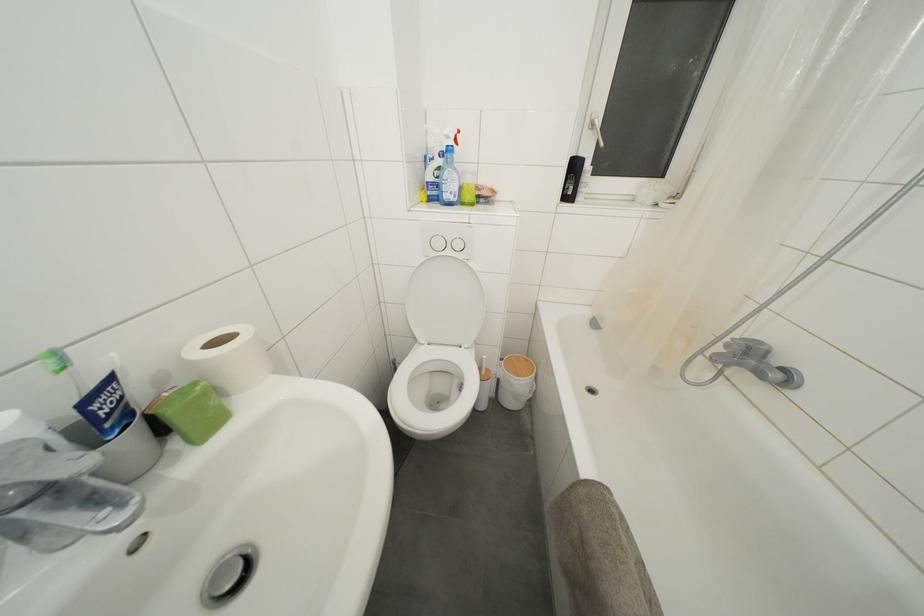
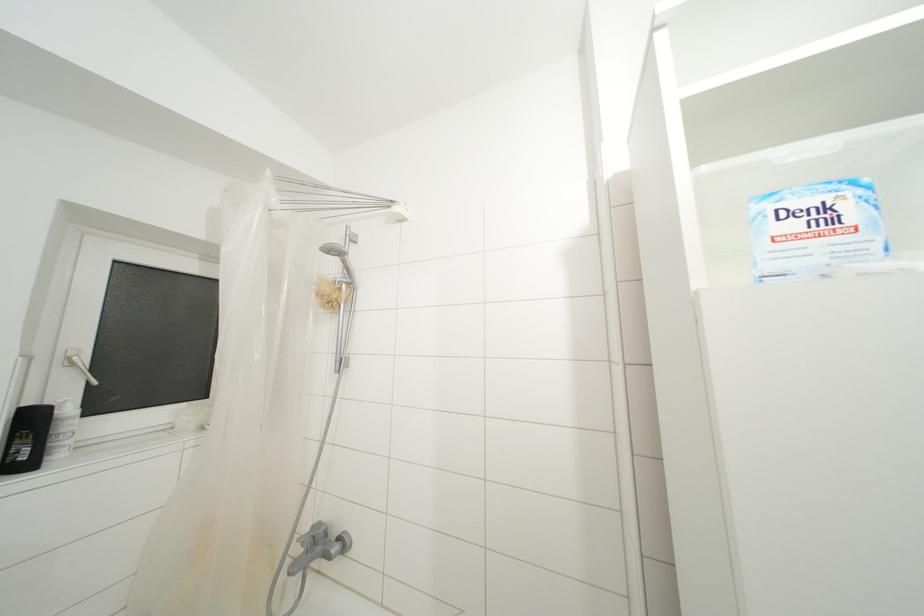
Question: The first image is from the beginning of the video and the second image is from the end. How did the camera likely rotate when shooting the video?

Choices:
 (A) Left
 (B) Right
 (C) Up
 (D) Down

Answer: (B)